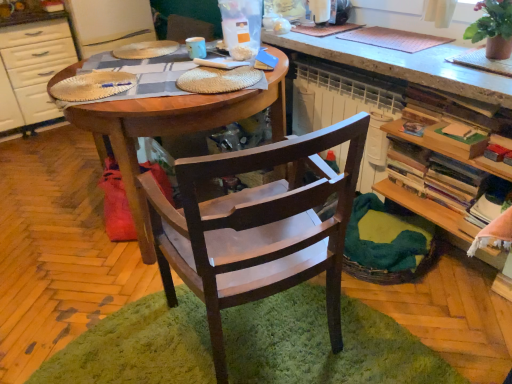
Find the location of a particular element. empty space that is ontop of wooden bookshelf at right (from a real-world perspective) is located at coordinates (x=453, y=149).